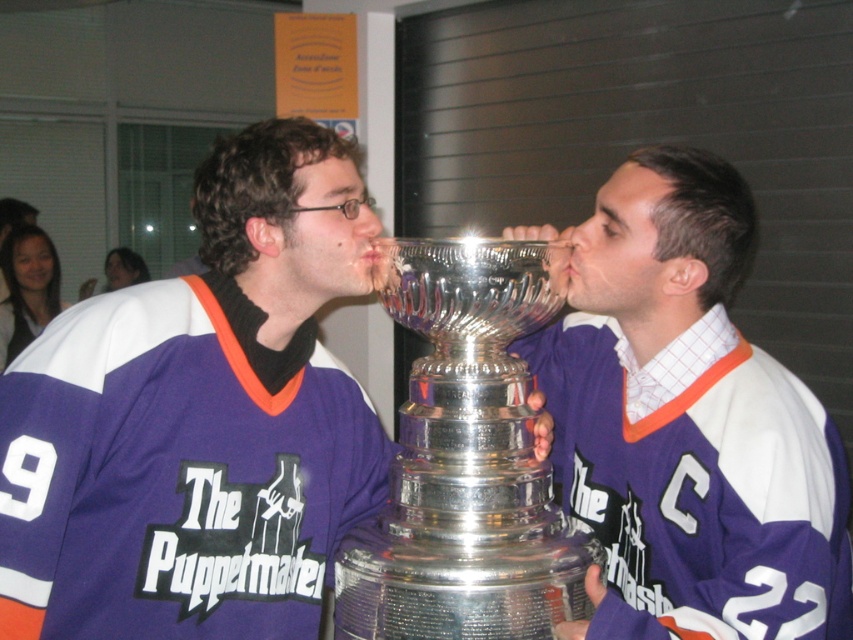
Question: Does purple jersey at center appear on the left side of silver polished trophy at center?

Choices:
 (A) no
 (B) yes

Answer: (A)

Question: Which is farther from the matte plastic nose at center?

Choices:
 (A) silver polished trophy at center
 (B) smooth skin nose at center

Answer: (A)

Question: Does silver polished trophy at center have a lesser width compared to smooth skin nose at center?

Choices:
 (A) yes
 (B) no

Answer: (B)

Question: Which object is positioned closest to the smooth skin nose at center?

Choices:
 (A) matte purple jersey at center
 (B) matte plastic nose at center

Answer: (B)

Question: Among these points, which one is nearest to the camera?

Choices:
 (A) (418, 326)
 (B) (595, 236)
 (C) (724, 356)

Answer: (A)

Question: Can you confirm if purple jersey at center is positioned to the right of smooth skin nose at center?

Choices:
 (A) yes
 (B) no

Answer: (A)